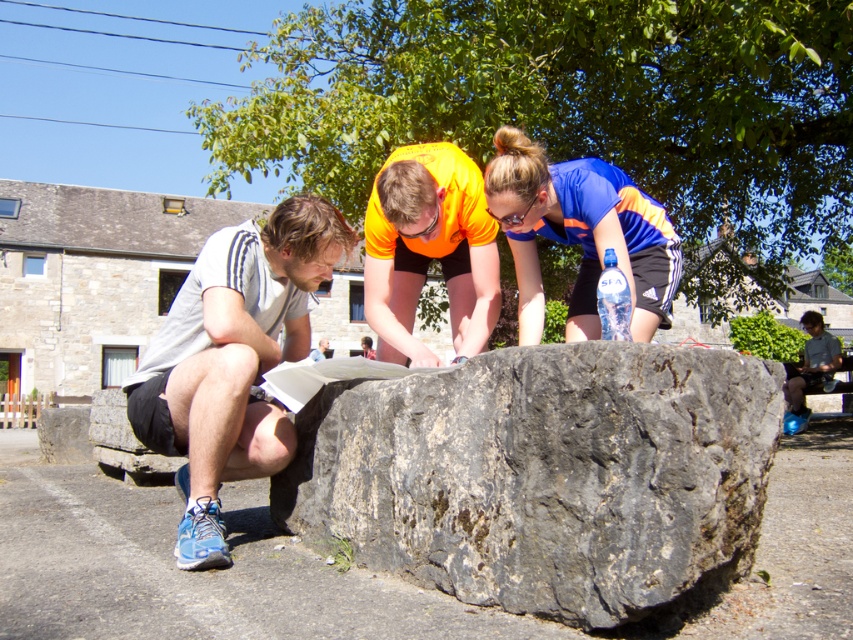
Question: Among these points, which one is nearest to the camera?

Choices:
 (A) (624, 337)
 (B) (309, 440)

Answer: (A)

Question: Is gray rough stone at center further to camera compared to blue jersey at center?

Choices:
 (A) no
 (B) yes

Answer: (A)

Question: Which object is closer to the camera taking this photo?

Choices:
 (A) dark gray stone bench at lower right
 (B) matte gray paper at lower left

Answer: (A)

Question: Estimate the real-world distances between objects in this image. Which object is closer to the white matte t-shirt at left?

Choices:
 (A) transparent plastic bottle at center
 (B) matte gray paper at lower left

Answer: (B)

Question: Observing the image, what is the correct spatial positioning of blue jersey at center in reference to transparent plastic bottle at center?

Choices:
 (A) left
 (B) right

Answer: (A)

Question: Does orange fabric shirt at center have a smaller size compared to matte gray paper at lower left?

Choices:
 (A) no
 (B) yes

Answer: (B)